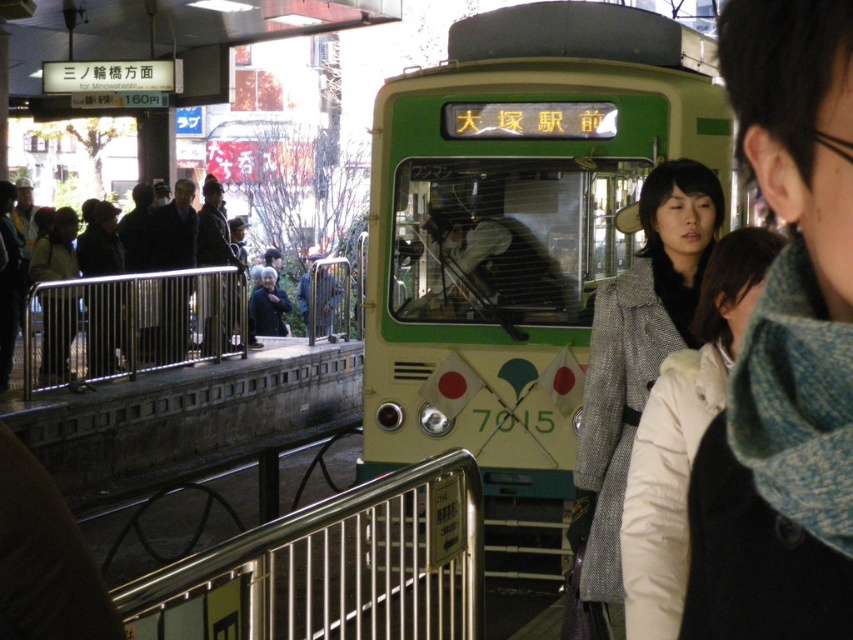
In the scene shown: You are a traveler at the train station and want to check if your blue knit scarf at center is small enough to fit into the pocket of your dark brown coat at center. Can you confirm?

The blue knit scarf at center has a smaller size compared to dark brown coat at center, so it should fit into the coat pocket.

You are a commuter waiting at the train station platform. You see a matte black coat at left and a dark gray fabric jacket at center. Which clothing item is closer to you on the platform?

The matte black coat at left is closer to you because it is in front of the dark gray fabric jacket at center.